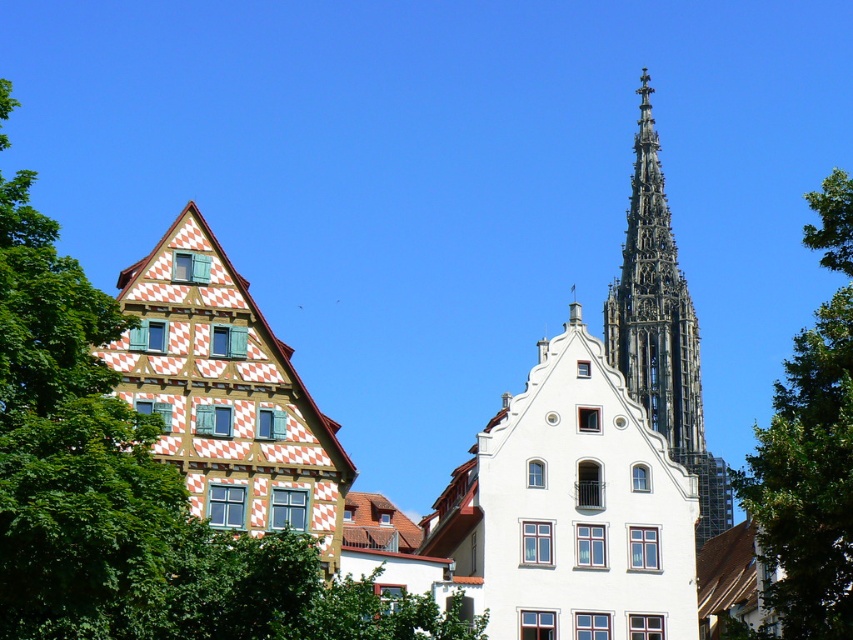
What do you see at coordinates (132, 492) in the screenshot? I see `green leafy tree at left` at bounding box center [132, 492].

From the picture: Is green leafy tree at left wider than green leafy tree at upper right?

Incorrect, green leafy tree at left's width does not surpass green leafy tree at upper right's.

I want to click on green leafy tree at left, so click(x=132, y=492).

Is green leafy tree at left thinner than dark gray stone spire at upper right?

Correct, green leafy tree at left's width is less than dark gray stone spire at upper right's.

From the picture: Which of these two, green leafy tree at left or dark gray stone spire at upper right, stands shorter?

green leafy tree at left is shorter.

Is point (33, 310) farther from camera compared to point (643, 300)?

No, (33, 310) is in front of (643, 300).

Identify the location of green leafy tree at left. This screenshot has height=640, width=853. (132, 492).

Is wooden checkered house at left positioned at the back of green leafy tree at upper right?

Yes, wooden checkered house at left is behind green leafy tree at upper right.

Is point (227, 388) closer to camera compared to point (842, 397)?

No.

Which is in front, point (256, 468) or point (804, 426)?

Point (804, 426) is in front.

The height and width of the screenshot is (640, 853). In order to click on wooden checkered house at left in this screenshot , I will do `click(225, 394)`.